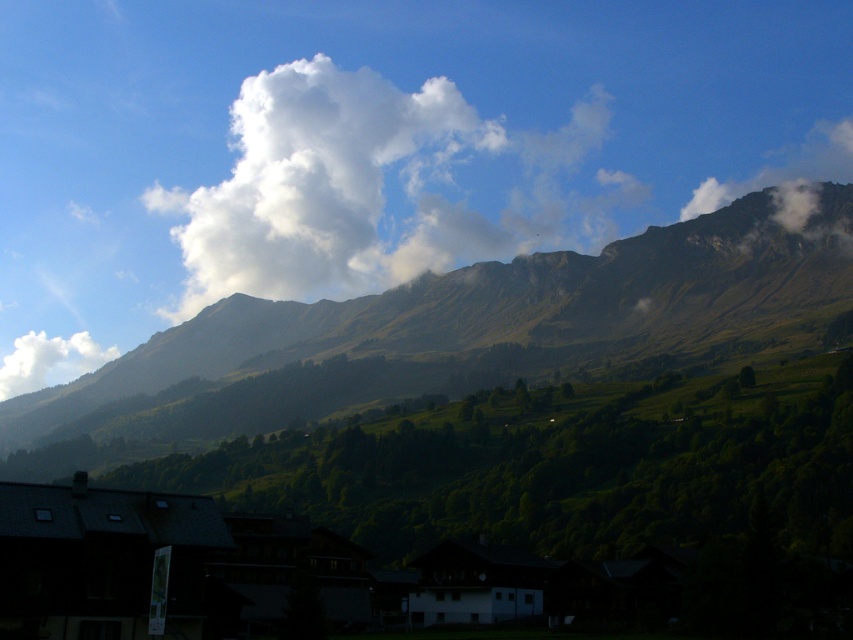
Who is taller, white fluffy cloud at upper center or white fluffy cloud at upper right?

white fluffy cloud at upper center is taller.

Between white fluffy cloud at upper center and white fluffy cloud at upper right, which one appears on the left side from the viewer's perspective?

white fluffy cloud at upper center is more to the left.

Is point (357, 216) less distant than point (700, 205)?

Yes, point (357, 216) is closer to viewer.

The width and height of the screenshot is (853, 640). I want to click on white fluffy cloud at upper center, so click(372, 188).

Which is more to the right, green grassy mountain at upper center or white fluffy cloud at upper right?

From the viewer's perspective, white fluffy cloud at upper right appears more on the right side.

Is the position of green grassy mountain at upper center less distant than that of white fluffy cloud at upper right?

Yes, green grassy mountain at upper center is closer to the viewer.

You are a GUI agent. You are given a task and a screenshot of the screen. Output one action in this format:
    pyautogui.click(x=<x>, y=<y>)
    Task: Click on the green grassy mountain at upper center
    The width and height of the screenshot is (853, 640).
    Given the screenshot: What is the action you would take?
    point(473,385)

The height and width of the screenshot is (640, 853). Identify the location of green grassy mountain at upper center. (473, 385).

Is point (729, 365) closer to camera compared to point (486, 244)?

That is True.

Does point (431, 388) come farther from viewer compared to point (252, 244)?

No, (431, 388) is closer to viewer.

I want to click on green grassy mountain at upper center, so click(473, 385).